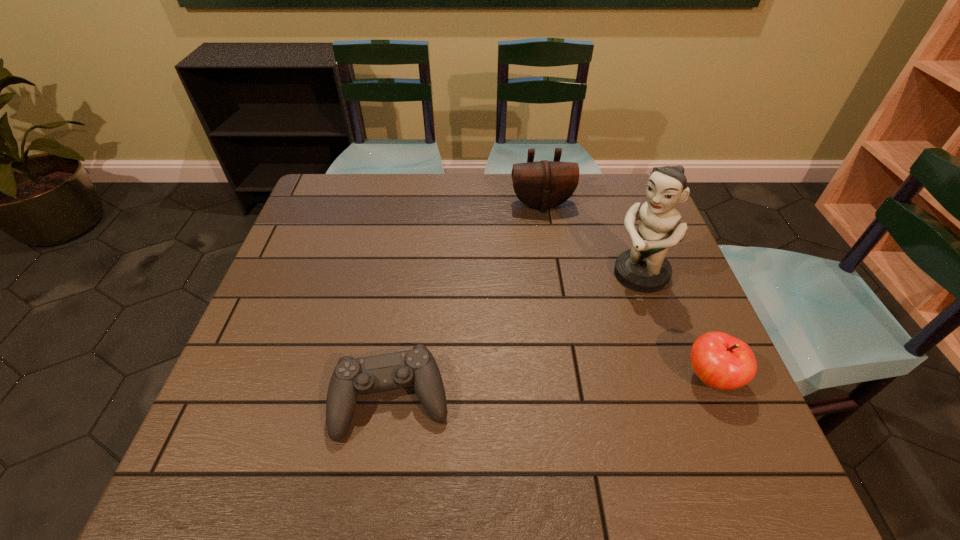
In order to click on free space on the desktop that is between the control and the apple and is positioned with the flap open on the third shortest object in this screenshot , I will do `click(583, 387)`.

Locate an element on the screen. free space on the desktop that is between the leftmost object and the apple and is positioned on the front-facing side of the third nearest object is located at coordinates click(x=507, y=392).